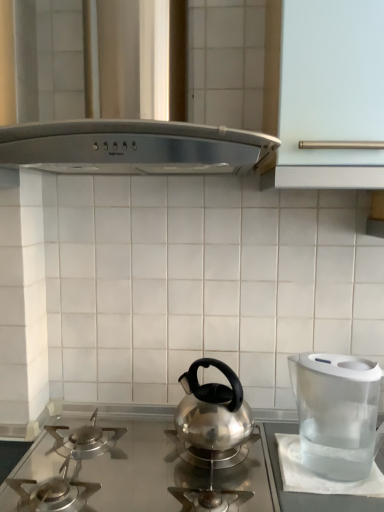
Question: Can you confirm if satin silver vent at upper center is shorter than transparent plastic water filter at right?

Choices:
 (A) no
 (B) yes

Answer: (A)

Question: Does satin silver vent at upper center appear on the left side of transparent plastic water filter at right?

Choices:
 (A) yes
 (B) no

Answer: (A)

Question: Is satin silver vent at upper center behind transparent plastic water filter at right?

Choices:
 (A) no
 (B) yes

Answer: (A)

Question: Considering the relative sizes of satin silver vent at upper center and transparent plastic water filter at right in the image provided, is satin silver vent at upper center smaller than transparent plastic water filter at right?

Choices:
 (A) yes
 (B) no

Answer: (B)

Question: Are satin silver vent at upper center and transparent plastic water filter at right located far from each other?

Choices:
 (A) yes
 (B) no

Answer: (B)

Question: From the image's perspective, is satin silver vent at upper center on transparent plastic water filter at right?

Choices:
 (A) yes
 (B) no

Answer: (A)

Question: From the image's perspective, would you say satin silver gas stove at center is shown under transparent plastic water filter at right?

Choices:
 (A) yes
 (B) no

Answer: (A)

Question: Can you confirm if satin silver gas stove at center is wider than transparent plastic water filter at right?

Choices:
 (A) no
 (B) yes

Answer: (B)

Question: Can you confirm if satin silver gas stove at center is thinner than transparent plastic water filter at right?

Choices:
 (A) no
 (B) yes

Answer: (A)

Question: Is satin silver gas stove at center not inside transparent plastic water filter at right?

Choices:
 (A) no
 (B) yes

Answer: (B)

Question: From the image's perspective, is satin silver gas stove at center above transparent plastic water filter at right?

Choices:
 (A) yes
 (B) no

Answer: (B)

Question: Can transparent plastic water filter at right be found inside satin silver gas stove at center?

Choices:
 (A) no
 (B) yes

Answer: (A)

Question: From a real-world perspective, is satin silver gas stove at center below satin silver vent at upper center?

Choices:
 (A) yes
 (B) no

Answer: (A)